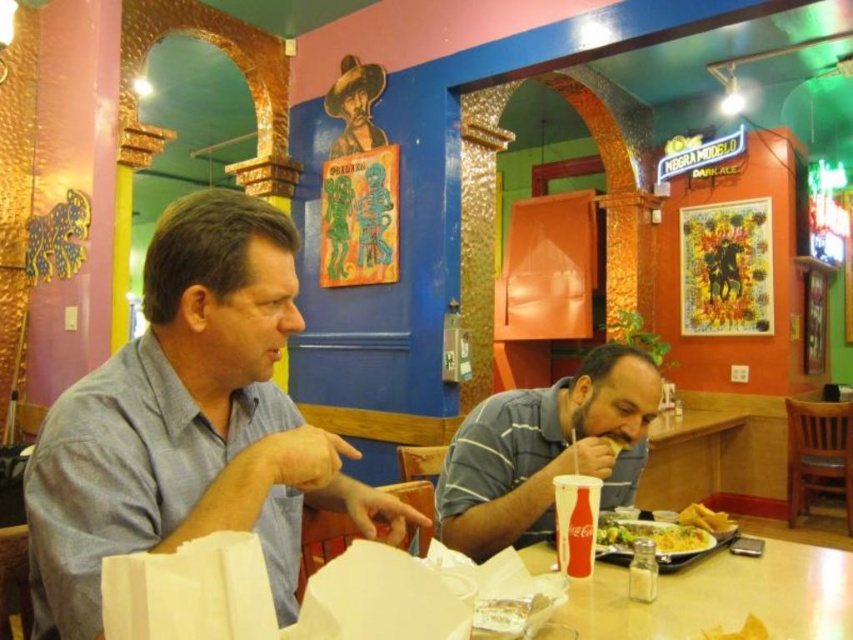
Does white paper cup at lower center appear over yellow tortilla chips at lower right?

Yes, white paper cup at lower center is above yellow tortilla chips at lower right.

Between white paper cup at lower center and yellow tortilla chips at lower right, which one appears on the left side from the viewer's perspective?

white paper cup at lower center

Which is behind, point (558, 557) or point (692, 513)?

The point (692, 513) is behind.

Find the location of a particular element. The height and width of the screenshot is (640, 853). white paper cup at lower center is located at coordinates (575, 522).

Does gray striped shirt at lower right have a smaller size compared to plastic disposable plate at center?

Actually, gray striped shirt at lower right might be larger than plastic disposable plate at center.

Find the location of a particular element. This screenshot has height=640, width=853. gray striped shirt at lower right is located at coordinates (544, 451).

From the picture: Can you confirm if gray cotton shirt at left is smaller than white paper cup at lower center?

Actually, gray cotton shirt at left might be larger than white paper cup at lower center.

Does gray cotton shirt at left appear on the right side of white paper cup at lower center?

No, gray cotton shirt at left is not to the right of white paper cup at lower center.

Which is behind, point (187, 504) or point (566, 561)?

Point (566, 561)

Find the location of `gray cotton shirt at left`. gray cotton shirt at left is located at coordinates (190, 422).